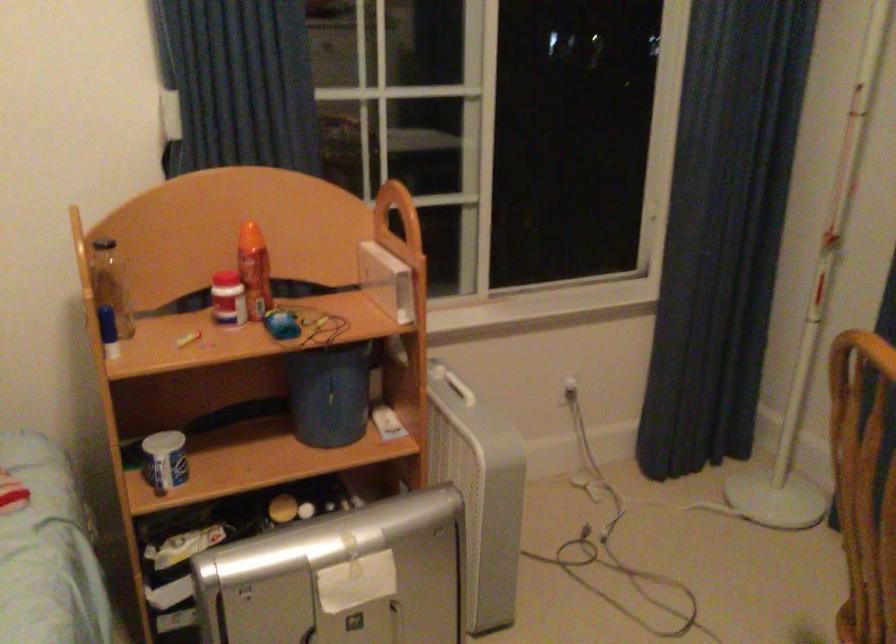
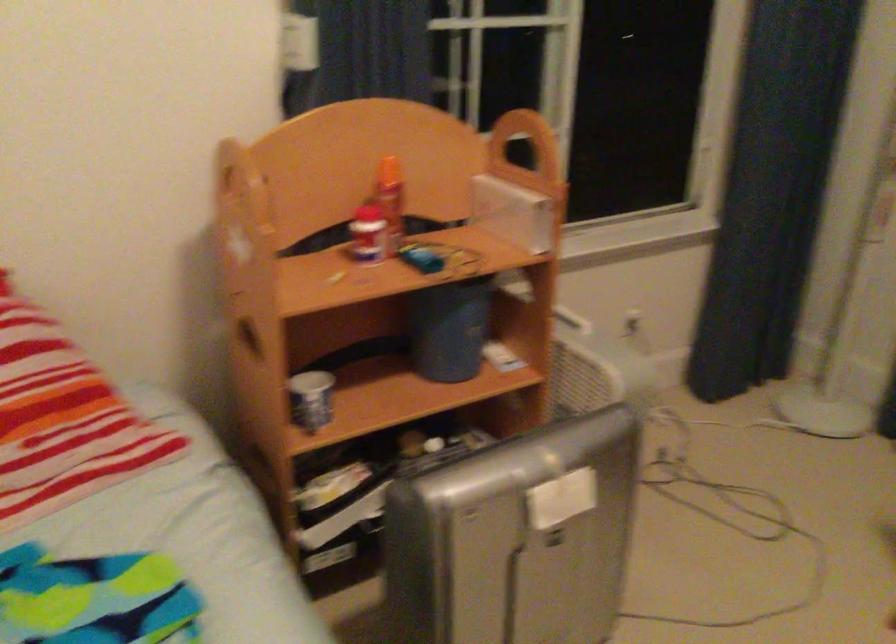
Find the pixel in the second image that matches point 320,395 in the first image.

(449, 328)